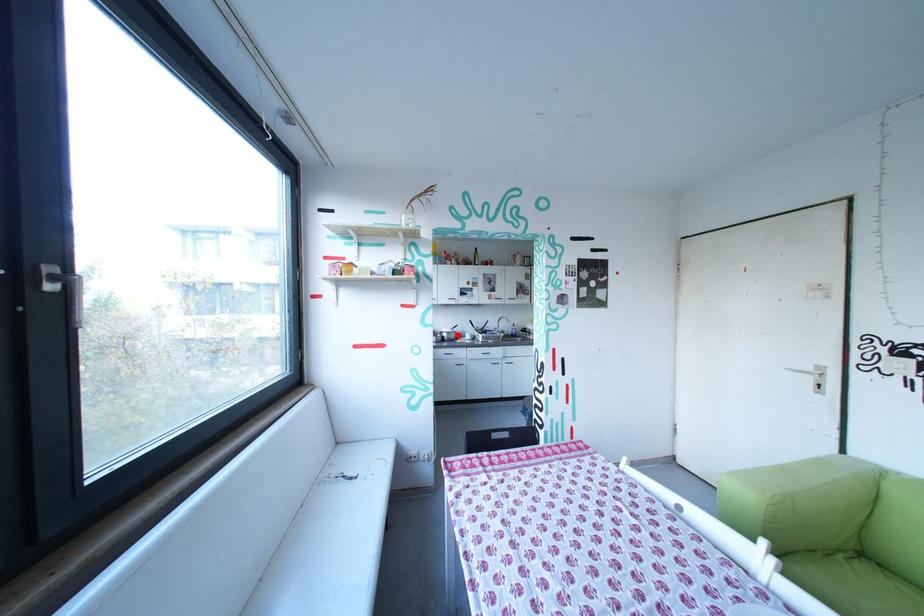
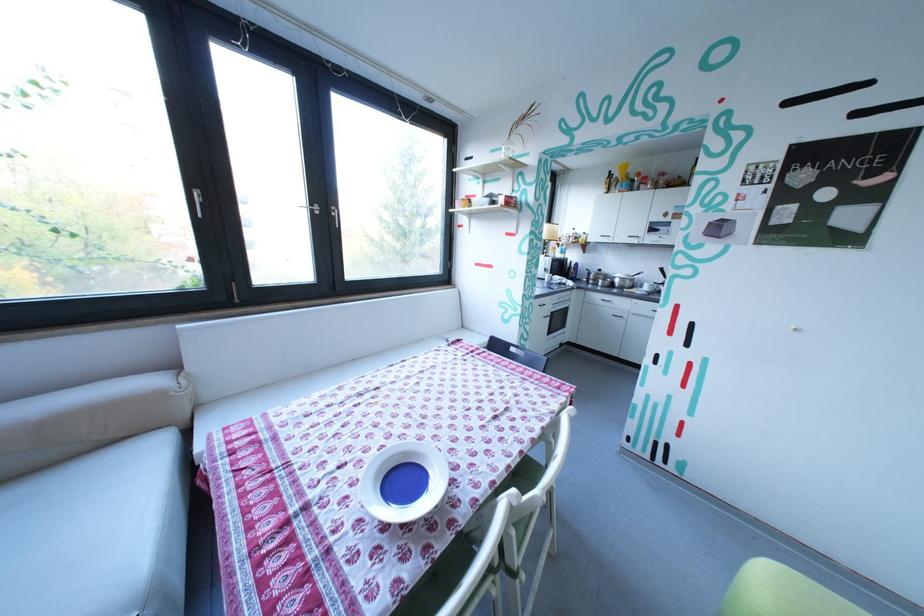
Question: A red point is marked in image1. In image2, is the corresponding 3D point closer to the camera or farther? Reply with the corresponding letter.

Choices:
 (A) The corresponding 3D point is closer.
 (B) The corresponding 3D point is farther.

Answer: (A)